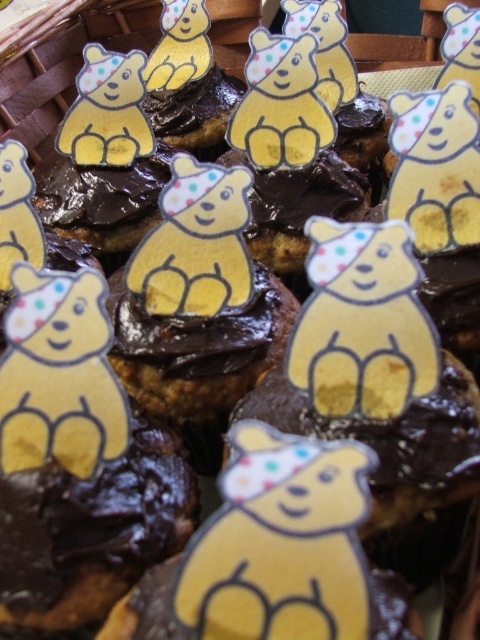
Question: Can you confirm if matte yellow bear at center is positioned below matte yellow bear at upper left?

Choices:
 (A) yes
 (B) no

Answer: (A)

Question: Which object is closer to the camera taking this photo?

Choices:
 (A) matte yellow bear at upper left
 (B) yellow paper bear at center
 (C) matte yellow bear at center

Answer: (C)

Question: Where is matte yellow bear at lower left located in relation to matte yellow bear at upper right in the image?

Choices:
 (A) right
 (B) left

Answer: (B)

Question: Which of the following is the farthest from the observer?

Choices:
 (A) yellow paper bear at center
 (B) matte yellow bear at upper right

Answer: (B)

Question: Is matte yellow bear at center closer to the viewer compared to matte yellow bear at upper left?

Choices:
 (A) yes
 (B) no

Answer: (A)

Question: Which object is farther from the camera taking this photo?

Choices:
 (A) matte yellow bear at center
 (B) matte yellow bear at upper left
 (C) matte yellow bear at lower left

Answer: (B)